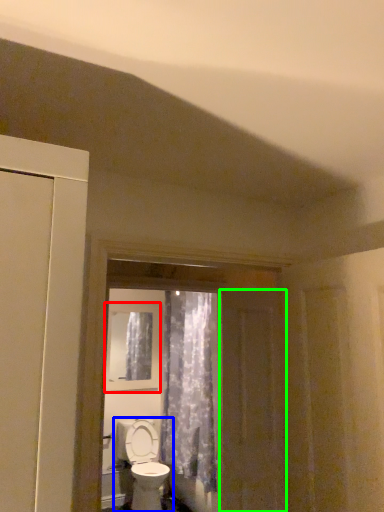
Question: Estimate the real-world distances between objects in this image. Which object is farther from window (highlighted by a red box), toilet (highlighted by a blue box) or screen door (highlighted by a green box)?

Choices:
 (A) toilet
 (B) screen door

Answer: (B)